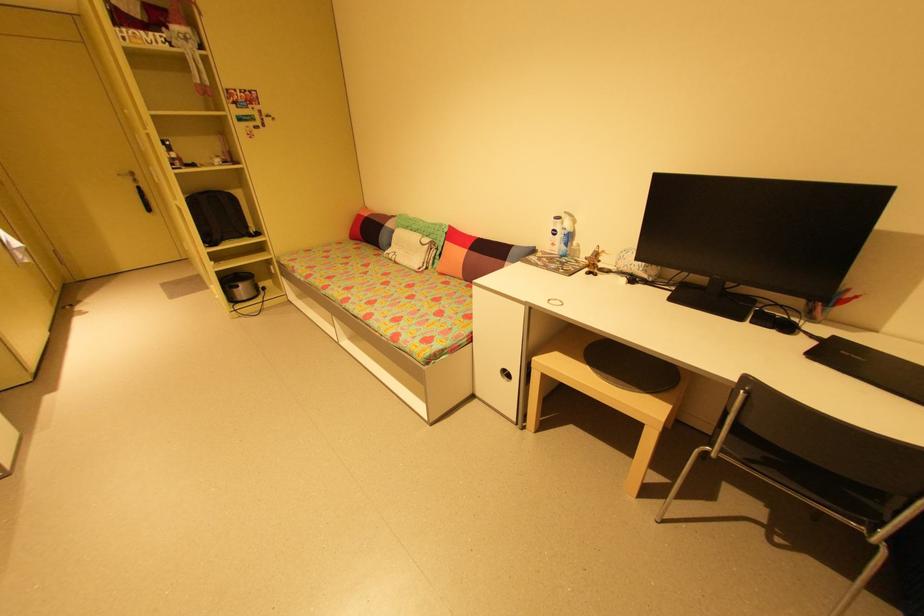
The image size is (924, 616). What do you see at coordinates (568, 245) in the screenshot?
I see `the spray bottle trigger` at bounding box center [568, 245].